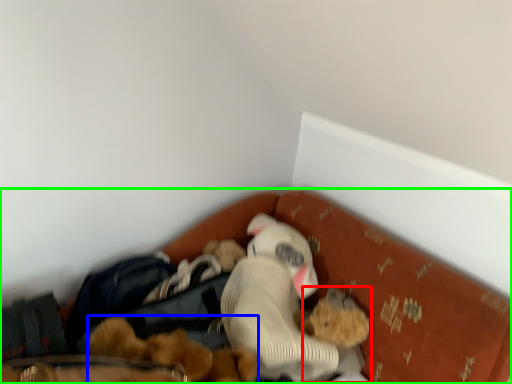
Question: Based on their relative distances, which object is nearer to toy (highlighted by a red box)? Choose from toy (highlighted by a blue box) and bed (highlighted by a green box).

Choices:
 (A) toy
 (B) bed

Answer: (A)